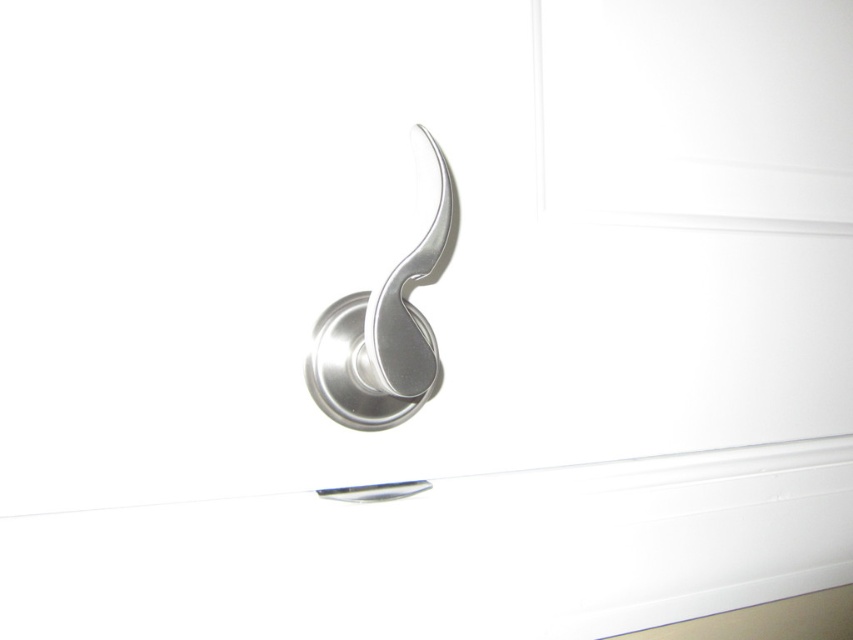
Between satin silver handle at center and polished silver door handle at center, which one appears on the right side from the viewer's perspective?

From the viewer's perspective, satin silver handle at center appears more on the right side.

Who is positioned more to the left, satin silver handle at center or polished silver door handle at center?

Positioned to the left is polished silver door handle at center.

This screenshot has height=640, width=853. What are the coordinates of `satin silver handle at center` in the screenshot? It's located at (445, 554).